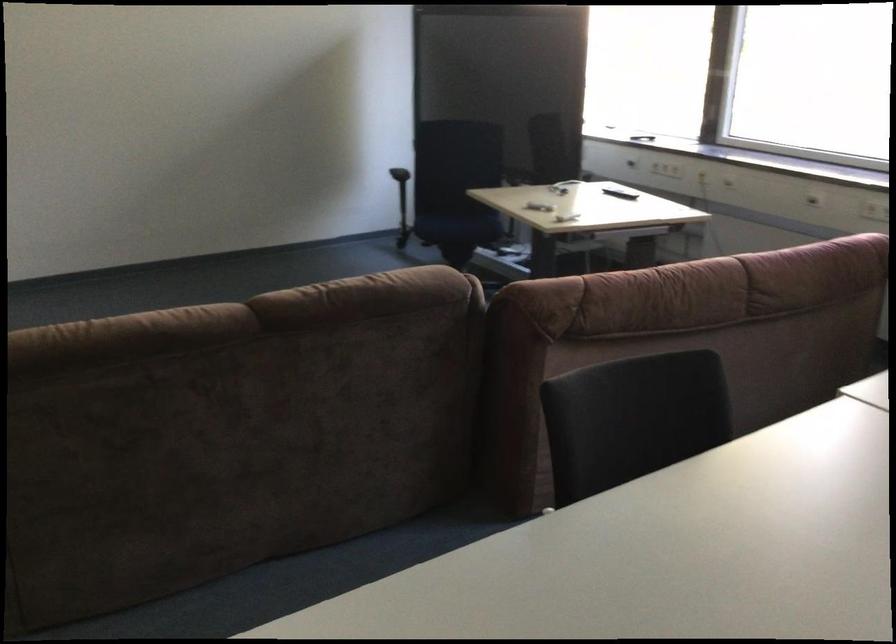
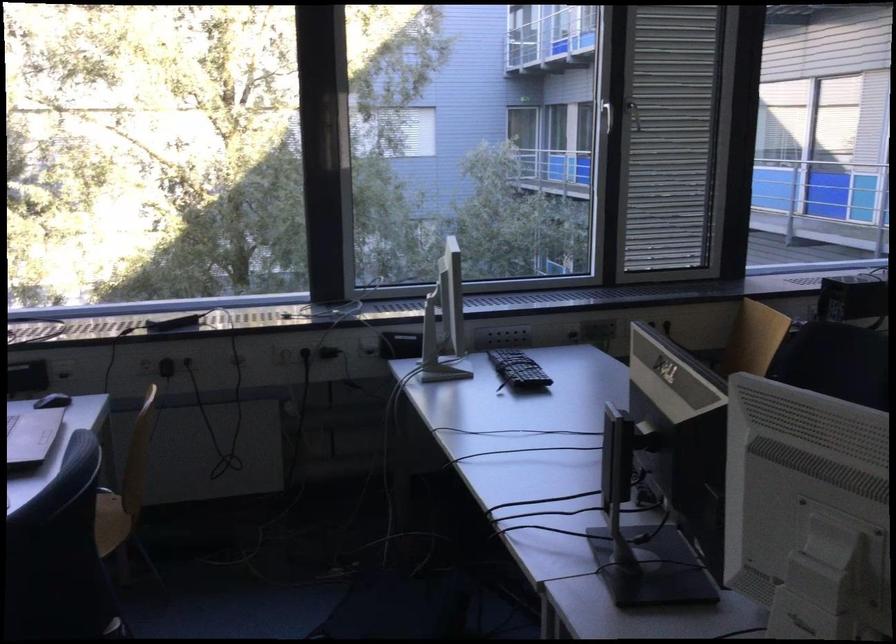
Question: Based on the continuous images, in which direction is the camera rotating? Reply with the corresponding letter.

Choices:
 (A) Left
 (B) Right
 (C) Up
 (D) Down

Answer: (B)